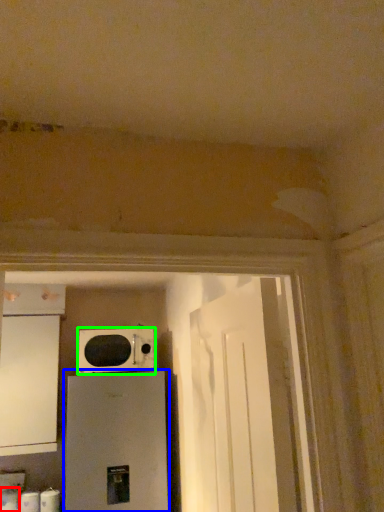
Question: Considering the real-world distances, which object is closest to toilet paper (highlighted by a red box)? home appliance (highlighted by a blue box) or microwave oven (highlighted by a green box).

Choices:
 (A) home appliance
 (B) microwave oven

Answer: (A)